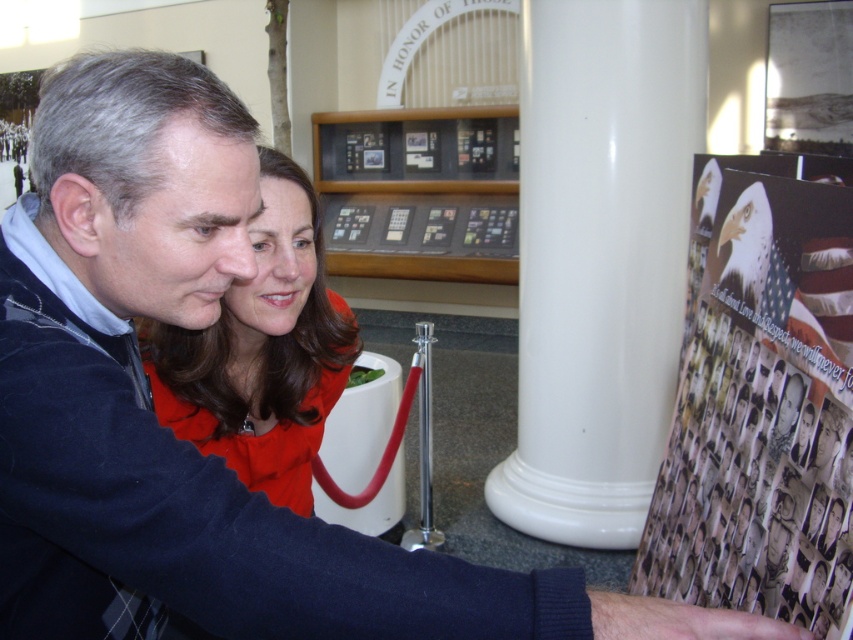
You are a visitor at the memorial and want to take a photo of both the printed paper poster at right and the black glass display case at center. Since you can only focus on one object at a time, which one should you focus on to ensure the other is still somewhat in view?

The printed paper poster at right is shorter than the black glass display case at center, so focusing on the taller black glass display case at center would keep the shorter printed paper poster at right in the background view.

You are a tour guide leading a group through the memorial. You want to walk from the man to the white glossy column at center. How many steps would you need to take if each step is approximately 2.5 feet?

The distance between the man and the white glossy column at center is 8.57 feet. Dividing this by the step length of 2.5 feet per step gives approximately 3.43 steps. Since you can only take whole steps, you would need to take 4 steps to reach the white glossy column at center.

You are a visitor at the memorial and want to take a photo of the matte red dress at center without the white glossy column at center blocking the view. Is the column likely to block the dress in your photo?

The white glossy column at center has a greater height compared to the matte red dress at center, so the column is taller than the dress. Since the column is taller, it might block the dress in your photo if they are aligned in the same line of sight.